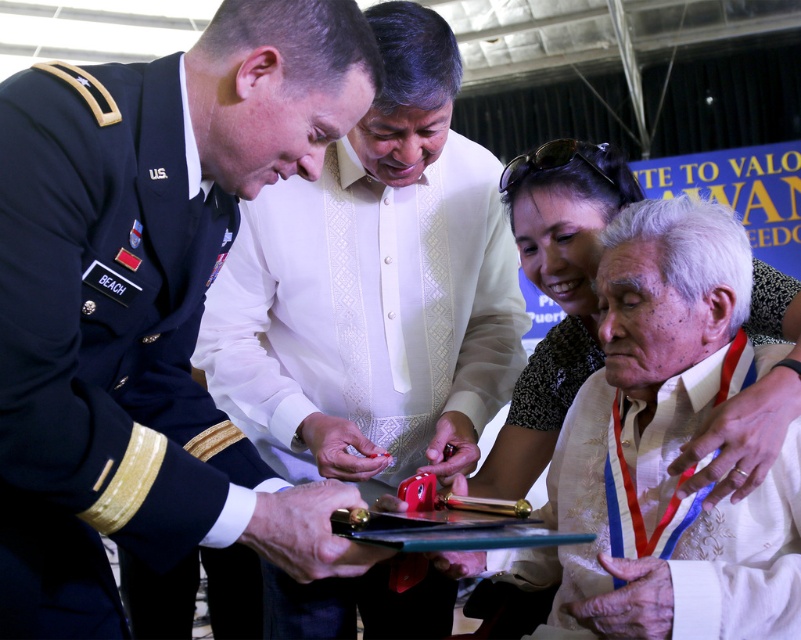
You are a photographer standing at a distance. You need to take a photo of the navy blue fabric uniform at center. What is the approximate distance you should stand to capture it clearly?

The navy blue fabric uniform at center is 35.71 inches from viewer, so you should stand approximately 35.71 inches away to capture it clearly.

Looking at this image, where is the navy blue fabric uniform at center located?

The navy blue fabric uniform at center is located at point (107, 349).